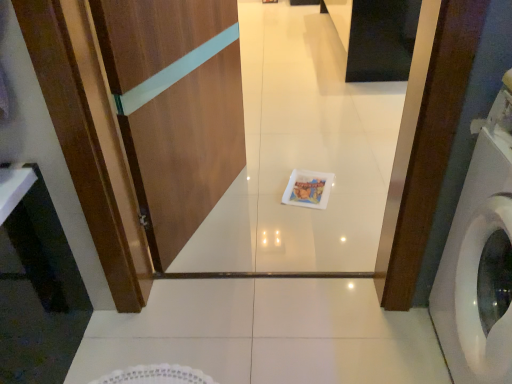
Find the location of a particular element. Image resolution: width=512 pixels, height=384 pixels. blank area beneath wooden screen door at center (from a real-world perspective) is located at coordinates (208, 216).